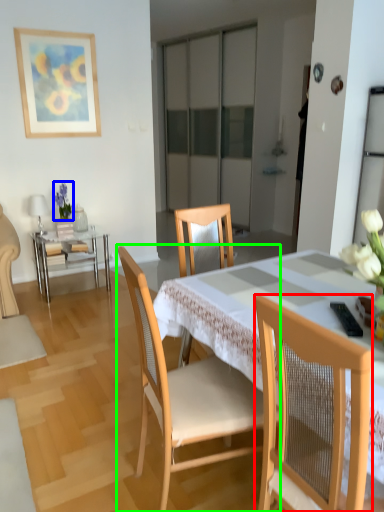
Question: Which object is the farthest from chair (highlighted by a red box)? Choose among these: floral arrangement (highlighted by a blue box) or chair (highlighted by a green box).

Choices:
 (A) floral arrangement
 (B) chair

Answer: (A)